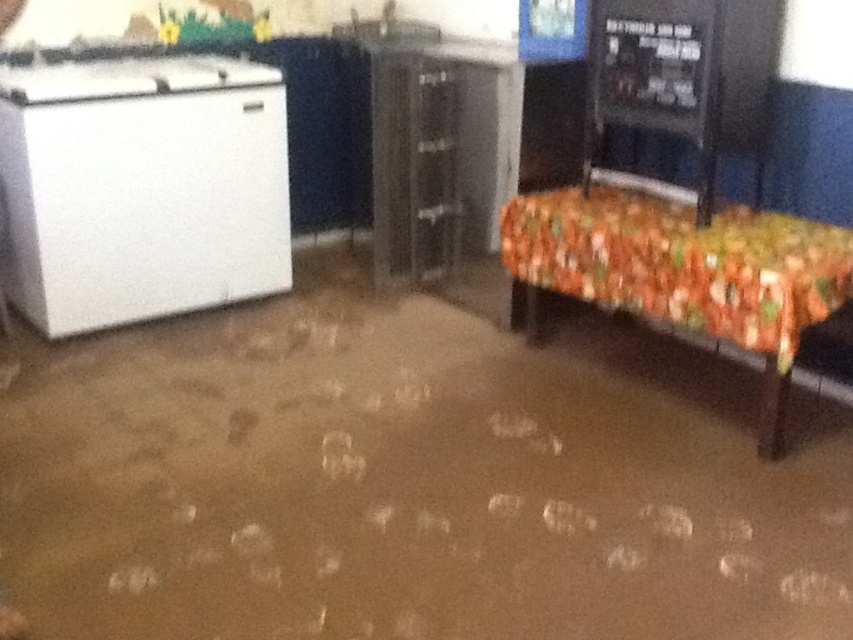
Question: Is white matte refrigerator at left smaller than floral fabric-covered bench at right?

Choices:
 (A) no
 (B) yes

Answer: (A)

Question: Among these points, which one is nearest to the camera?

Choices:
 (A) (782, 348)
 (B) (9, 289)

Answer: (A)

Question: Which point is closer to the camera?

Choices:
 (A) white matte refrigerator at left
 (B) floral fabric-covered bench at right

Answer: (B)

Question: Can you confirm if white matte refrigerator at left is positioned to the right of floral fabric-covered bench at right?

Choices:
 (A) yes
 (B) no

Answer: (B)

Question: Is white matte refrigerator at left in front of floral fabric-covered bench at right?

Choices:
 (A) no
 (B) yes

Answer: (A)

Question: Which point is closer to the camera taking this photo?

Choices:
 (A) (242, 248)
 (B) (833, 248)

Answer: (B)